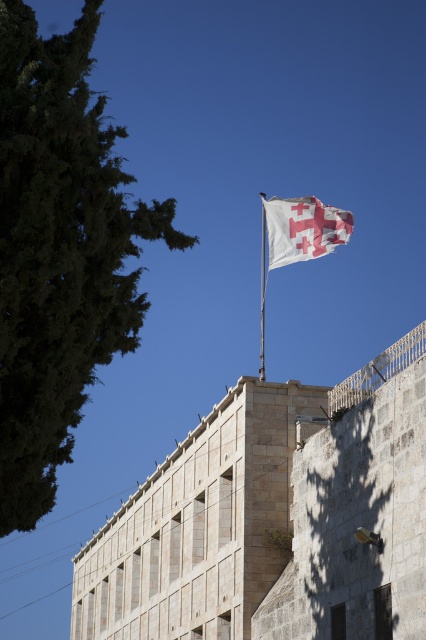
Question: Does white fabric flag at upper center appear on the left side of white fabric flag pole at upper center?

Choices:
 (A) yes
 (B) no

Answer: (B)

Question: Is white fabric flag at upper center further to camera compared to white fabric flag pole at upper center?

Choices:
 (A) yes
 (B) no

Answer: (A)

Question: Among these points, which one is farthest from the camera?

Choices:
 (A) (299, 246)
 (B) (259, 378)

Answer: (A)

Question: Which of the following is the closest to the observer?

Choices:
 (A) (348, 237)
 (B) (264, 326)

Answer: (A)

Question: Is white fabric flag at upper center above white fabric flag pole at upper center?

Choices:
 (A) no
 (B) yes

Answer: (B)